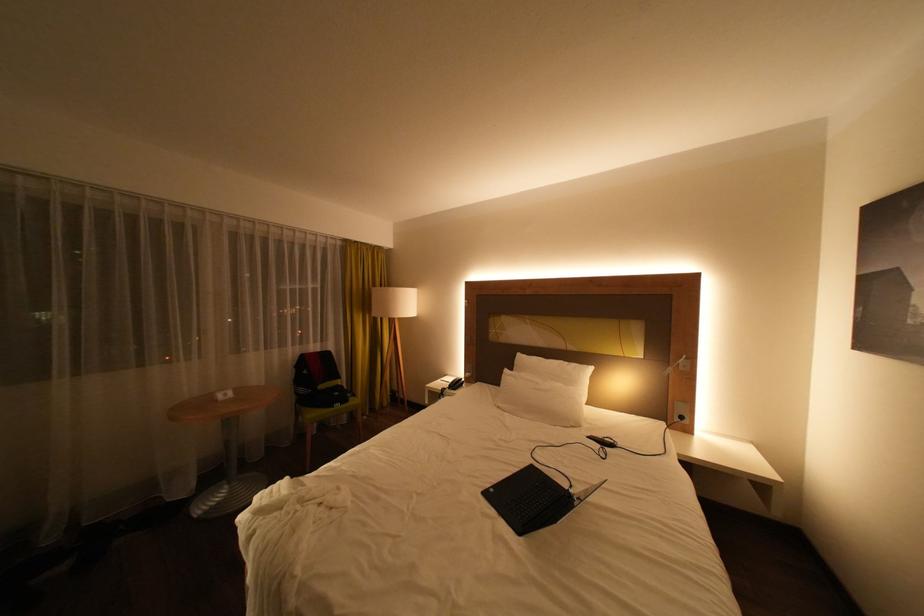
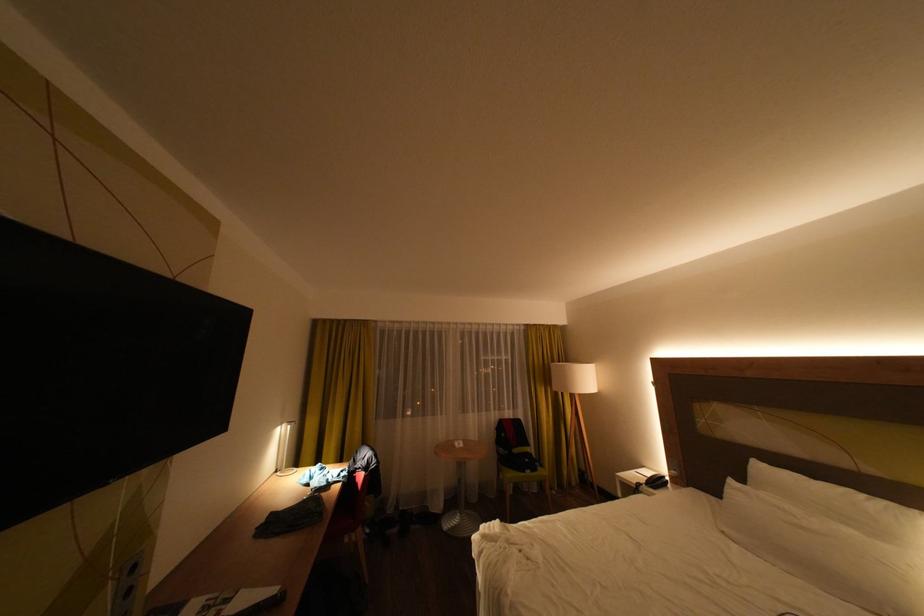
In the second image, find the point that corresponds to point (400, 394) in the first image.

(590, 472)